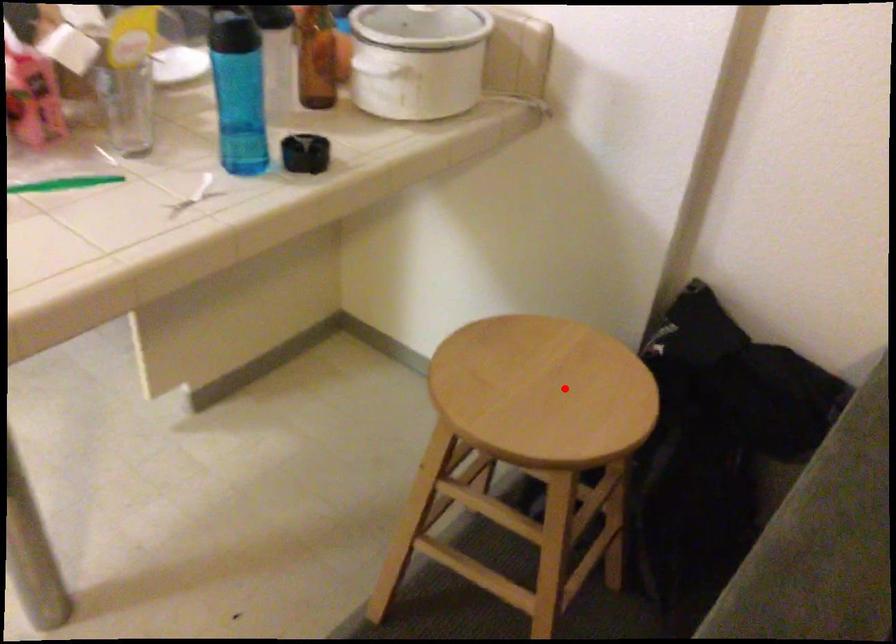
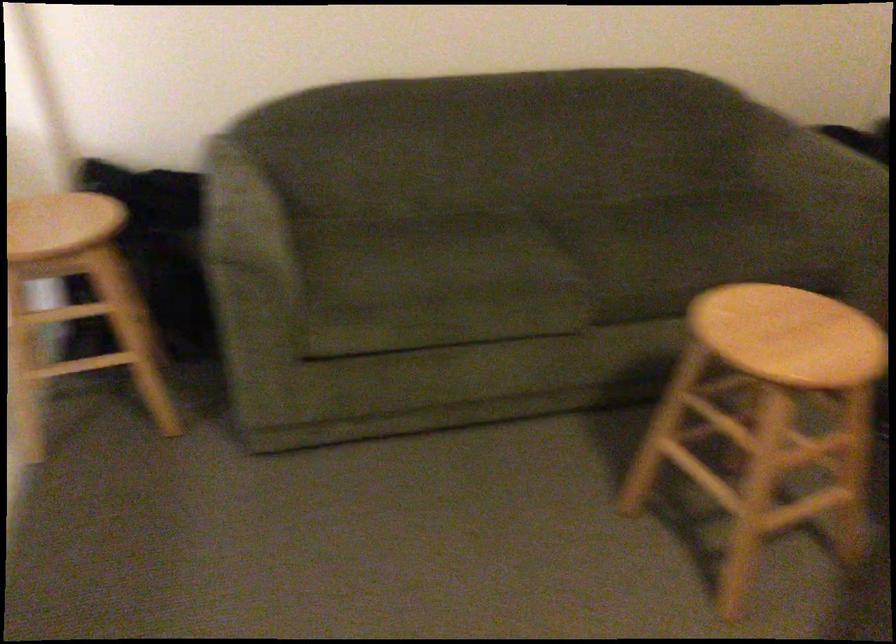
Where in the second image is the point corresponding to the highlighted location from the first image?

(59, 223)